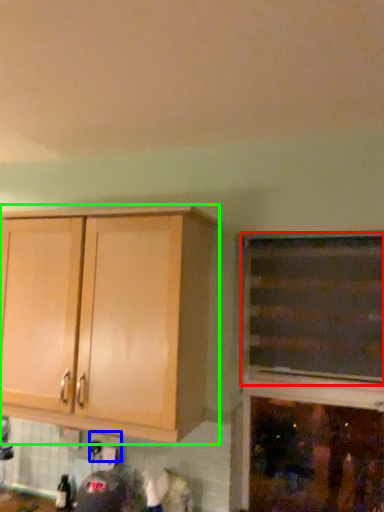
Question: Considering the real-world distances, which object is farthest from cabinetry (highlighted by a red box)? electric outlet (highlighted by a blue box) or cabinetry (highlighted by a green box)?

Choices:
 (A) electric outlet
 (B) cabinetry

Answer: (A)